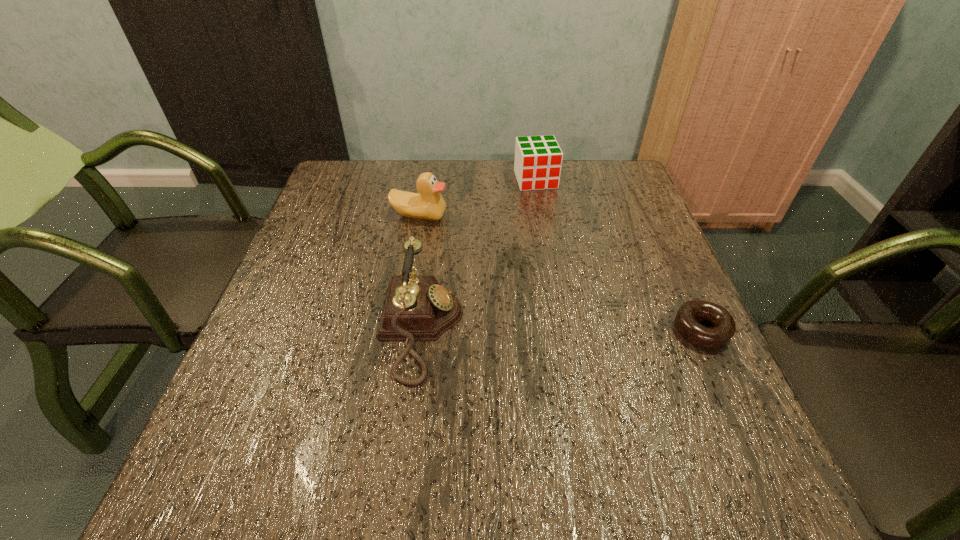
In the image, there is a desktop. Where is `vacant space at the far left corner`? This screenshot has height=540, width=960. vacant space at the far left corner is located at coordinates (333, 205).

At what (x,y) coordinates should I click in order to perform the action: click on free space at the far right corner of the desktop. Please return your answer as a coordinate pair (x, y). The width and height of the screenshot is (960, 540). Looking at the image, I should click on (590, 162).

The width and height of the screenshot is (960, 540). I want to click on free space at the near right corner of the desktop, so click(689, 414).

The image size is (960, 540). What are the coordinates of `vacant space that's between the farthest object and the doughnut` in the screenshot? It's located at (619, 255).

Find the location of a particular element. free space between the telephone and the doughnut is located at coordinates (562, 329).

Locate an element on the screen. The image size is (960, 540). vacant space in between the telephone and the second object from right to left is located at coordinates (478, 254).

Locate an element on the screen. The image size is (960, 540). vacant space in between the farthest object and the telephone is located at coordinates (478, 254).

I want to click on empty space that is in between the telephone and the duck, so click(x=420, y=272).

The image size is (960, 540). Find the location of `free space between the second farthest object and the shortest object`. free space between the second farthest object and the shortest object is located at coordinates (561, 273).

Where is `free spot between the third nearest object and the tallest object`? This screenshot has height=540, width=960. free spot between the third nearest object and the tallest object is located at coordinates pyautogui.click(x=420, y=272).